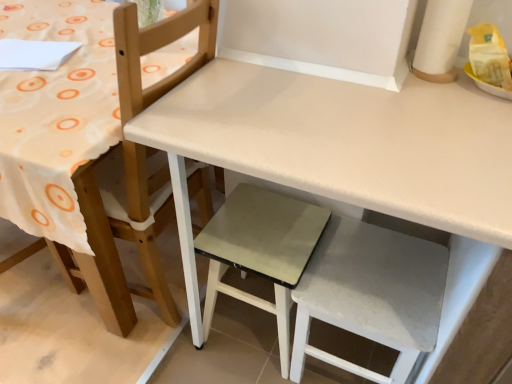
Question: Is point (419, 240) closer or farther from the camera than point (91, 291)?

Choices:
 (A) closer
 (B) farther

Answer: (A)

Question: Would you say white fabric step stool at lower right, the 1th step stool from the right, is to the left or to the right of white matte chair at upper left in the picture?

Choices:
 (A) right
 (B) left

Answer: (A)

Question: Which object is positioned farthest from the matte gray step stool at center, which is the first step stool in left-to-right order?

Choices:
 (A) white matte chair at upper left
 (B) white matte table at center
 (C) white fabric step stool at lower right, placed as the second step stool when sorted from left to right

Answer: (B)

Question: Estimate the real-world distances between objects in this image. Which object is closer to the matte gray step stool at center, acting as the second step stool starting from the right?

Choices:
 (A) white matte chair at upper left
 (B) white matte table at center
 (C) white fabric step stool at lower right, the 1th step stool from the right

Answer: (C)